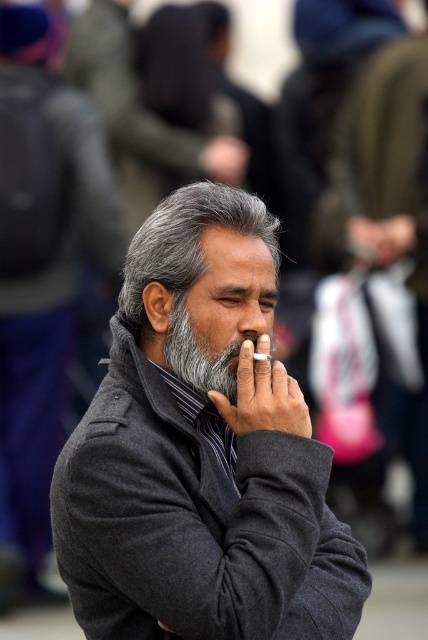
Does gray matte beard at center have a lesser width compared to gray matte nose at center?

No, gray matte beard at center is not thinner than gray matte nose at center.

How distant is gray matte beard at center from gray matte nose at center?

A distance of 8.55 inches exists between gray matte beard at center and gray matte nose at center.

Where is `gray matte beard at center`? The height and width of the screenshot is (640, 428). gray matte beard at center is located at coordinates (198, 356).

Is gray wool coat at center bigger than gray matte nose at center?

Yes.

Between gray wool coat at center and gray matte nose at center, which one is positioned higher?

gray wool coat at center is higher up.

Which is behind, point (70, 227) or point (261, 314)?

Point (70, 227)

Where is `gray wool coat at center`? The height and width of the screenshot is (640, 428). gray wool coat at center is located at coordinates (41, 269).

Can you confirm if gray wool coat at center is shorter than gray matte beard at center?

Incorrect, gray wool coat at center's height does not fall short of gray matte beard at center's.

Between point (14, 147) and point (225, 371), which one is positioned behind?

Point (14, 147)

This screenshot has width=428, height=640. I want to click on gray wool coat at center, so (41, 269).